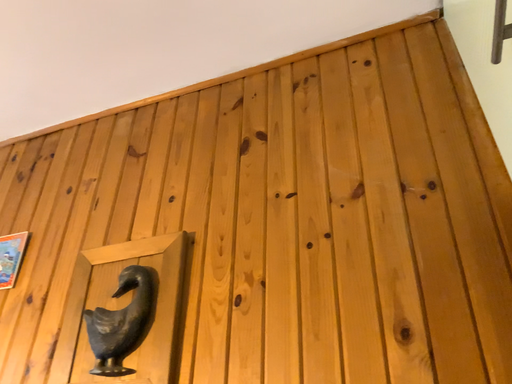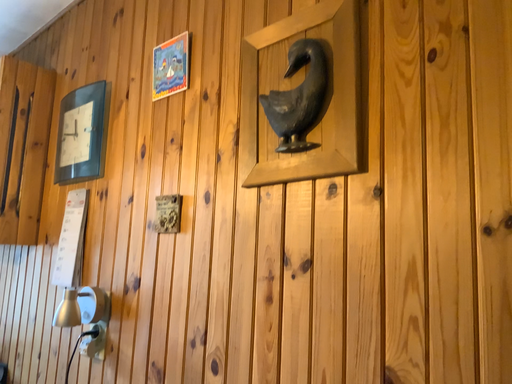
Question: Which way did the camera rotate in the video?

Choices:
 (A) rotated downward
 (B) rotated upward

Answer: (A)